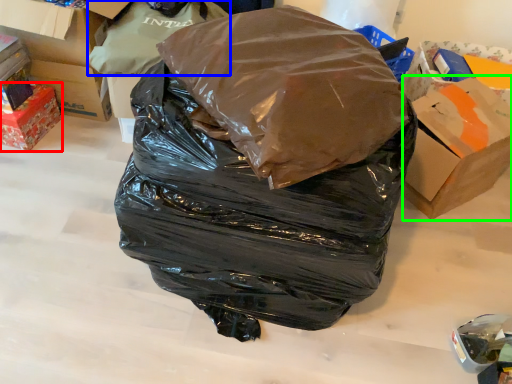
Question: Considering the real-world distances, which object is closest to box (highlighted by a red box)? plastic bag (highlighted by a blue box) or cardboard box (highlighted by a green box).

Choices:
 (A) plastic bag
 (B) cardboard box

Answer: (A)